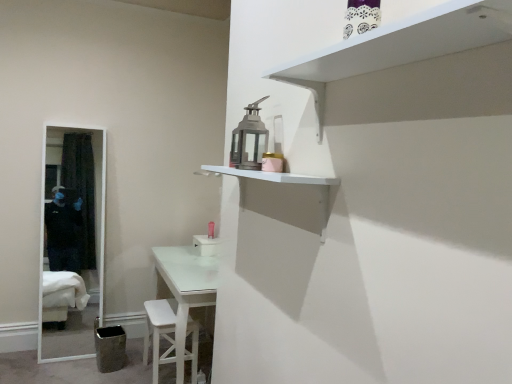
Question: From a real-world perspective, is pink matte toiletry at center located beneath white matte shelf at upper center, placed as the 1th shelf when sorted from bottom to top?

Choices:
 (A) yes
 (B) no

Answer: (A)

Question: From a real-world perspective, is pink matte toiletry at center physically above white matte shelf at upper center, placed as the 1th shelf when sorted from bottom to top?

Choices:
 (A) yes
 (B) no

Answer: (B)

Question: Is pink matte toiletry at center facing towards white matte shelf at upper center, placed as the second shelf when sorted from top to bottom?

Choices:
 (A) no
 (B) yes

Answer: (A)

Question: Does pink matte toiletry at center have a larger size compared to white matte shelf at upper center, placed as the second shelf when sorted from top to bottom?

Choices:
 (A) no
 (B) yes

Answer: (A)

Question: Does pink matte toiletry at center have a lesser height compared to white matte shelf at upper center, placed as the second shelf when sorted from top to bottom?

Choices:
 (A) yes
 (B) no

Answer: (A)

Question: Can you confirm if pink matte toiletry at center is thinner than white matte shelf at upper center, placed as the 1th shelf when sorted from bottom to top?

Choices:
 (A) no
 (B) yes

Answer: (B)

Question: Is the position of pink matte toiletry at center more distant than that of white wooden stool at lower center?

Choices:
 (A) yes
 (B) no

Answer: (A)

Question: Is pink matte toiletry at center turned away from white wooden stool at lower center?

Choices:
 (A) yes
 (B) no

Answer: (B)

Question: Does pink matte toiletry at center appear on the left side of white wooden stool at lower center?

Choices:
 (A) no
 (B) yes

Answer: (A)

Question: From the image's perspective, would you say pink matte toiletry at center is shown under white wooden stool at lower center?

Choices:
 (A) yes
 (B) no

Answer: (B)

Question: Can we say pink matte toiletry at center lies outside white wooden stool at lower center?

Choices:
 (A) yes
 (B) no

Answer: (A)

Question: Is pink matte toiletry at center surrounding white wooden stool at lower center?

Choices:
 (A) yes
 (B) no

Answer: (B)

Question: Is white matte shelf at upper right, which is the 1th shelf in top-to-bottom order, aimed at pink matte toiletry at center?

Choices:
 (A) yes
 (B) no

Answer: (B)